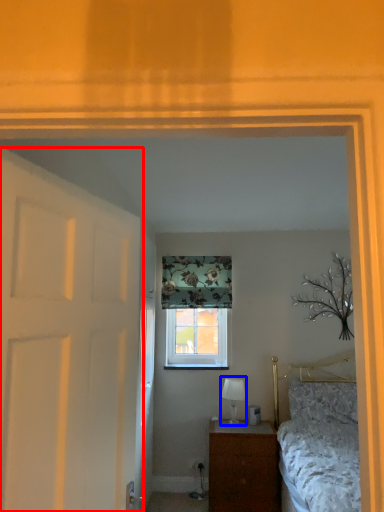
Question: Which object appears farthest to the camera in this image, door (highlighted by a red box) or table lamp (highlighted by a blue box)?

Choices:
 (A) door
 (B) table lamp

Answer: (B)